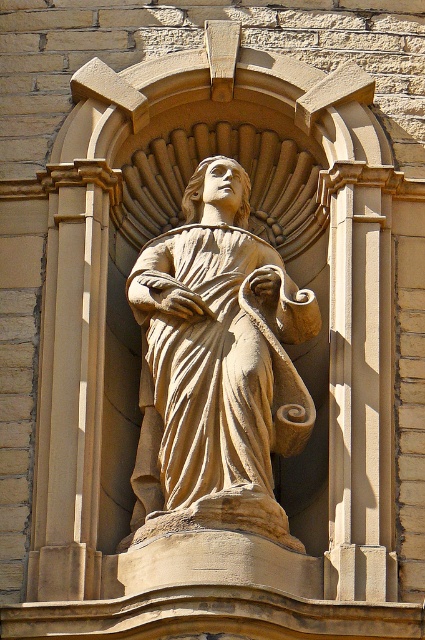
Is beige stone statue at center further to camera compared to beige stone column at left?

No, beige stone statue at center is closer to the viewer.

Is point (266, 288) farther from camera compared to point (87, 205)?

That is False.

Locate an element on the screen. The image size is (425, 640). beige stone statue at center is located at coordinates point(217,365).